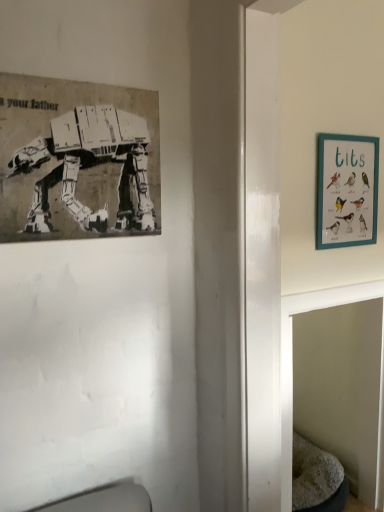
What do you see at coordinates (347, 190) in the screenshot?
I see `teal wooden picture frame at upper right, acting as the 2th picture frame starting from the front` at bounding box center [347, 190].

This screenshot has height=512, width=384. What are the coordinates of `teal wooden picture frame at upper right, the first picture frame positioned from the right` in the screenshot? It's located at (347, 190).

Considering the relative sizes of teal wooden picture frame at upper right, which is the 2th picture frame from left to right, and gray fabric cat bed at lower right in the image provided, is teal wooden picture frame at upper right, which is the 2th picture frame from left to right, thinner than gray fabric cat bed at lower right?

Yes, teal wooden picture frame at upper right, which is the 2th picture frame from left to right, is thinner than gray fabric cat bed at lower right.

Find the location of a particular element. The image size is (384, 512). table directly beneath the teal wooden picture frame at upper right, which is the 2th picture frame from left to right (from a real-world perspective) is located at coordinates pos(292,358).

Looking at this image, from a real-world perspective, is teal wooden picture frame at upper right, acting as the 2th picture frame starting from the front, above or below gray fabric cat bed at lower right?

teal wooden picture frame at upper right, acting as the 2th picture frame starting from the front, is situated higher than gray fabric cat bed at lower right in the real world.

Is teal wooden picture frame at upper right, acting as the 2th picture frame starting from the front, touching gray fabric cat bed at lower right?

No.

Where is `picture frame above the teal wooden picture frame at upper right, arranged as the first picture frame when viewed from the back (from a real-world perspective)`? This screenshot has height=512, width=384. picture frame above the teal wooden picture frame at upper right, arranged as the first picture frame when viewed from the back (from a real-world perspective) is located at coordinates (77, 160).

From a real-world perspective, which is physically above, black paper poster at upper left, marked as the 1th picture frame in a front-to-back arrangement, or teal wooden picture frame at upper right, the first picture frame positioned from the right?

black paper poster at upper left, marked as the 1th picture frame in a front-to-back arrangement, is physically above.

Which is closer to the camera, [20,154] or [354,207]?

Point [20,154] appears to be closer to the viewer than point [354,207].

Between black paper poster at upper left, marked as the 1th picture frame in a front-to-back arrangement, and teal wooden picture frame at upper right, which is the 2th picture frame from left to right, which one is positioned in front?

black paper poster at upper left, marked as the 1th picture frame in a front-to-back arrangement, is in front.

From a real-world perspective, which object rests below the other?

gray fabric cat bed at lower right, from a real-world perspective.

From the image's perspective, is gray fabric cat bed at lower right located above or below teal wooden picture frame at upper right, the first picture frame positioned from the right?

From the image's perspective, gray fabric cat bed at lower right appears below teal wooden picture frame at upper right, the first picture frame positioned from the right.

At what (x,y) coordinates should I click in order to perform the action: click on picture frame that is the 1st one when counting upward from the gray fabric cat bed at lower right (from the image's perspective). Please return your answer as a coordinate pair (x, y). This screenshot has height=512, width=384. Looking at the image, I should click on (347, 190).

Which object is positioned more to the left, gray fabric cat bed at lower right or teal wooden picture frame at upper right, the first picture frame positioned from the right?

teal wooden picture frame at upper right, the first picture frame positioned from the right, is more to the left.

Which object is more forward, teal wooden picture frame at upper right, acting as the 2th picture frame starting from the front, or black paper poster at upper left, marked as the 1th picture frame in a front-to-back arrangement?

Positioned in front is black paper poster at upper left, marked as the 1th picture frame in a front-to-back arrangement.

Is teal wooden picture frame at upper right, the first picture frame positioned from the right, not close to black paper poster at upper left, marked as the 1th picture frame in a front-to-back arrangement?

They are positioned close to each other.

Is teal wooden picture frame at upper right, acting as the 2th picture frame starting from the front, bigger or smaller than black paper poster at upper left, marked as the 1th picture frame in a front-to-back arrangement?

In the image, teal wooden picture frame at upper right, acting as the 2th picture frame starting from the front, appears to be smaller than black paper poster at upper left, marked as the 1th picture frame in a front-to-back arrangement.

Is teal wooden picture frame at upper right, acting as the 2th picture frame starting from the front, thinner than black paper poster at upper left, marked as the second picture frame in a right-to-left arrangement?

Correct, the width of teal wooden picture frame at upper right, acting as the 2th picture frame starting from the front, is less than that of black paper poster at upper left, marked as the second picture frame in a right-to-left arrangement.

Is gray fabric cat bed at lower right closer to camera compared to black paper poster at upper left, marked as the second picture frame in a right-to-left arrangement?

No, gray fabric cat bed at lower right is behind black paper poster at upper left, marked as the second picture frame in a right-to-left arrangement.

Is gray fabric cat bed at lower right at the right side of black paper poster at upper left, marked as the second picture frame in a right-to-left arrangement?

Indeed, gray fabric cat bed at lower right is positioned on the right side of black paper poster at upper left, marked as the second picture frame in a right-to-left arrangement.

How different are the orientations of gray fabric cat bed at lower right and black paper poster at upper left, marked as the 1th picture frame in a front-to-back arrangement, in degrees?

gray fabric cat bed at lower right and black paper poster at upper left, marked as the 1th picture frame in a front-to-back arrangement, are facing 0.605 degrees away from each other.

In the scene shown: From the image's perspective, is gray fabric cat bed at lower right under black paper poster at upper left, marked as the second picture frame in a right-to-left arrangement?

Correct, gray fabric cat bed at lower right appears lower than black paper poster at upper left, marked as the second picture frame in a right-to-left arrangement, in the image.

Is black paper poster at upper left, acting as the 1th picture frame starting from the left, not near gray fabric cat bed at lower right?

No.

From a real-world perspective, is black paper poster at upper left, marked as the second picture frame in a right-to-left arrangement, on top of gray fabric cat bed at lower right?

Indeed, from a real-world perspective, black paper poster at upper left, marked as the second picture frame in a right-to-left arrangement, stands above gray fabric cat bed at lower right.

Can you confirm if black paper poster at upper left, marked as the second picture frame in a right-to-left arrangement, is shorter than gray fabric cat bed at lower right?

Indeed, black paper poster at upper left, marked as the second picture frame in a right-to-left arrangement, has a lesser height compared to gray fabric cat bed at lower right.

In terms of size, does black paper poster at upper left, marked as the second picture frame in a right-to-left arrangement, appear bigger or smaller than gray fabric cat bed at lower right?

Clearly, black paper poster at upper left, marked as the second picture frame in a right-to-left arrangement, is smaller in size than gray fabric cat bed at lower right.

Where is `table to the right of teal wooden picture frame at upper right, acting as the 2th picture frame starting from the front`? The image size is (384, 512). table to the right of teal wooden picture frame at upper right, acting as the 2th picture frame starting from the front is located at coordinates (292, 358).

Identify the location of picture frame that is under the black paper poster at upper left, marked as the 1th picture frame in a front-to-back arrangement (from a real-world perspective). (347, 190).

From the image, which object appears to be farther from gray fabric cat bed at lower right, black paper poster at upper left, marked as the 1th picture frame in a front-to-back arrangement, or teal wooden picture frame at upper right, acting as the 2th picture frame starting from the front?

black paper poster at upper left, marked as the 1th picture frame in a front-to-back arrangement, is positioned further to the anchor gray fabric cat bed at lower right.

Looking at this image, estimate the real-world distances between objects in this image. Which object is further from gray fabric cat bed at lower right, teal wooden picture frame at upper right, acting as the 2th picture frame starting from the front, or black paper poster at upper left, acting as the 1th picture frame starting from the left?

black paper poster at upper left, acting as the 1th picture frame starting from the left.

When comparing their distances from teal wooden picture frame at upper right, the first picture frame positioned from the right, does gray fabric cat bed at lower right or black paper poster at upper left, marked as the second picture frame in a right-to-left arrangement, seem closer?

gray fabric cat bed at lower right is closer to teal wooden picture frame at upper right, the first picture frame positioned from the right.

When comparing their distances from teal wooden picture frame at upper right, the first picture frame positioned from the right, does black paper poster at upper left, marked as the 1th picture frame in a front-to-back arrangement, or gray fabric cat bed at lower right seem further?

Based on the image, black paper poster at upper left, marked as the 1th picture frame in a front-to-back arrangement, appears to be further to teal wooden picture frame at upper right, the first picture frame positioned from the right.

Which object lies further to the anchor point black paper poster at upper left, marked as the 1th picture frame in a front-to-back arrangement, gray fabric cat bed at lower right or teal wooden picture frame at upper right, the first picture frame positioned from the right?

Based on the image, teal wooden picture frame at upper right, the first picture frame positioned from the right, appears to be further to black paper poster at upper left, marked as the 1th picture frame in a front-to-back arrangement.

Based on their spatial positions, is teal wooden picture frame at upper right, acting as the 2th picture frame starting from the front, or gray fabric cat bed at lower right further from black paper poster at upper left, marked as the 1th picture frame in a front-to-back arrangement?

teal wooden picture frame at upper right, acting as the 2th picture frame starting from the front, is positioned further to the anchor black paper poster at upper left, marked as the 1th picture frame in a front-to-back arrangement.

Locate an element on the screen. The image size is (384, 512). picture frame between black paper poster at upper left, marked as the 1th picture frame in a front-to-back arrangement, and gray fabric cat bed at lower right vertically is located at coordinates (347, 190).